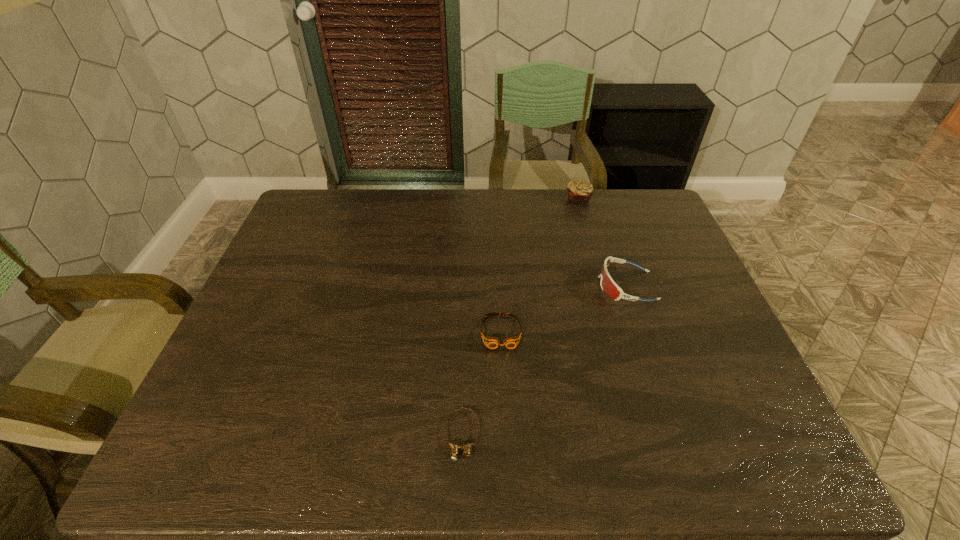
The height and width of the screenshot is (540, 960). In order to click on muffin in this screenshot , I will do `click(579, 190)`.

Where is `the tallest goggles`? the tallest goggles is located at coordinates (610, 288).

Find the location of a particular element. The image size is (960, 540). the second farthest object is located at coordinates (610, 288).

Where is `the second goggles from left to right`? The width and height of the screenshot is (960, 540). the second goggles from left to right is located at coordinates (491, 342).

Locate an element on the screen. The width and height of the screenshot is (960, 540). the second farthest goggles is located at coordinates (491, 342).

At what (x,y) coordinates should I click in order to perform the action: click on the nearest goggles. Please return your answer as a coordinate pair (x, y). Looking at the image, I should click on (454, 448).

The height and width of the screenshot is (540, 960). I want to click on the leftmost goggles, so click(x=454, y=448).

Locate an element on the screen. This screenshot has height=540, width=960. vacant point located on the left of the farthest object is located at coordinates (537, 199).

This screenshot has height=540, width=960. I want to click on vacant space located on the front-facing side of the third nearest object, so click(548, 286).

Find the location of a particular element. The width and height of the screenshot is (960, 540). free space located on the front-facing side of the third nearest object is located at coordinates (563, 286).